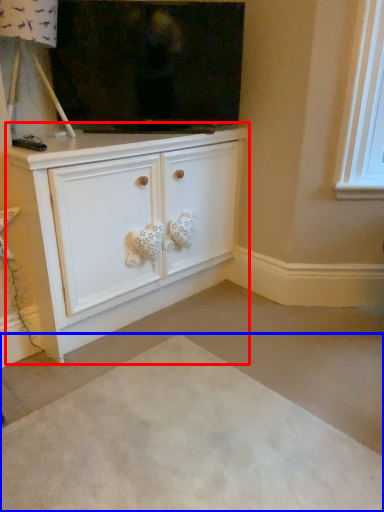
Question: Which object is closer to the camera taking this photo, cabinetry (highlighted by a red box) or plain (highlighted by a blue box)?

Choices:
 (A) cabinetry
 (B) plain

Answer: (B)